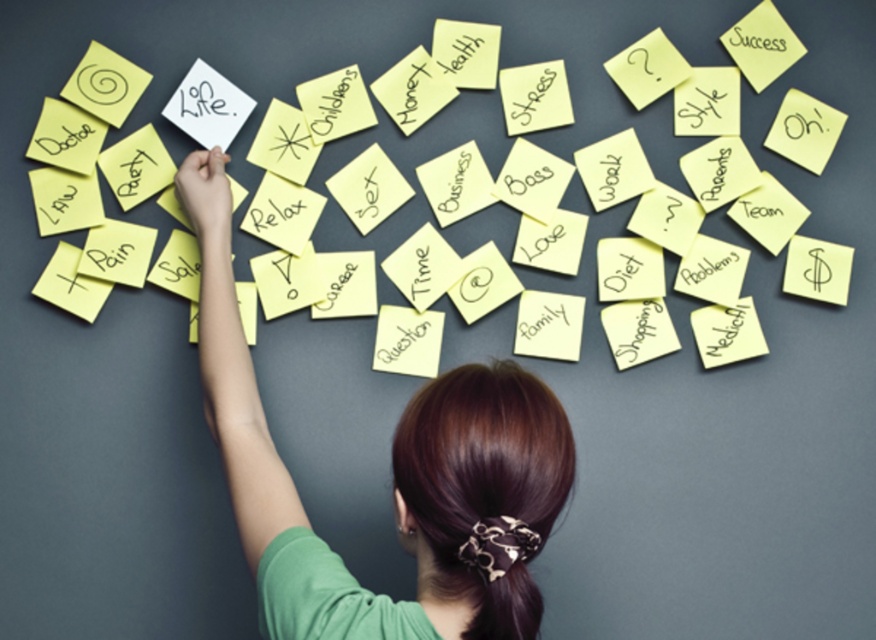
You are an assistant organizing a brainstorming session. You see the green fabric shirt at center and the matte yellow sticky note at upper right. Which object is located above the other?

The matte yellow sticky note at upper right is above the green fabric shirt at center because the green fabric shirt at center is positioned under the matte yellow sticky note at upper right.

You are standing in front of a collection of yellow sticky notes on a dark gray surface. You notice two points marked as point 1 at coordinates (463, 440) and point 2 at coordinates (746, 48). Which point is closer to you?

Point 1 at coordinates (463, 440) is closer to you than point 2 at coordinates (746, 48).

You are an observer looking at the scene. Which object is taller between the green fabric shirt at center and the matte yellow sticky note at upper right?

The green fabric shirt at center is taller than the matte yellow sticky note at upper right.